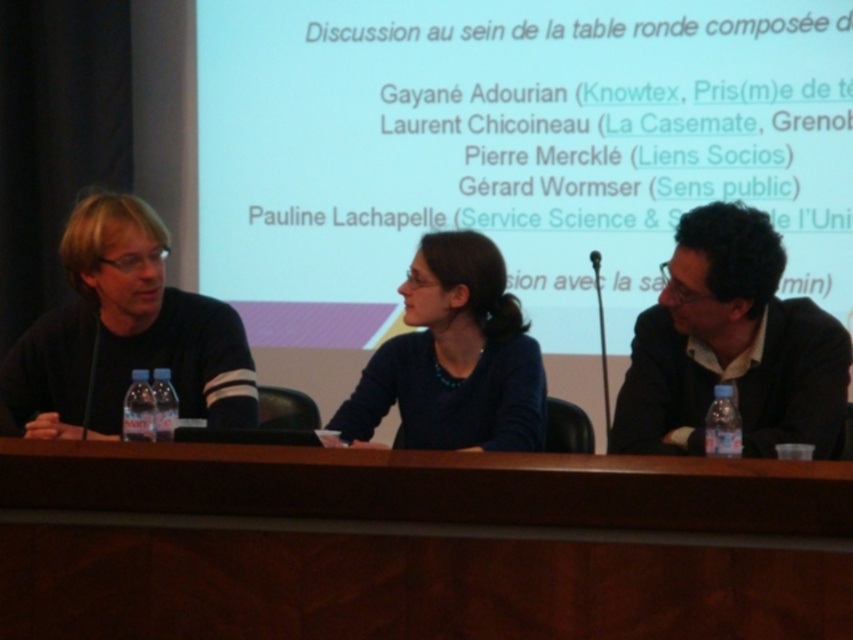
Which is below, brown wood table at center or dark brown leather jacket at right?

brown wood table at center is below.

Does brown wood table at center have a greater height compared to dark brown leather jacket at right?

Incorrect, brown wood table at center's height is not larger of dark brown leather jacket at right's.

Is point (103, 573) closer to camera compared to point (670, 330)?

That is True.

Image resolution: width=853 pixels, height=640 pixels. What are the coordinates of `brown wood table at center` in the screenshot? It's located at tap(416, 545).

Can you confirm if brown wood table at center is positioned to the right of black matte shirt at left?

Correct, you'll find brown wood table at center to the right of black matte shirt at left.

Measure the distance between brown wood table at center and black matte shirt at left.

brown wood table at center and black matte shirt at left are 37.55 inches apart from each other.

Where is `brown wood table at center`? The image size is (853, 640). brown wood table at center is located at coordinates (416, 545).

Between dark brown leather jacket at right and matte blue sweater at center, which one is positioned lower?

matte blue sweater at center

Measure the distance between point (689,410) and camera.

A distance of 2.59 meters exists between point (689,410) and camera.

Which is behind, point (720, 241) or point (492, 307)?

The point (492, 307) is behind.

Where is `dark brown leather jacket at right`? dark brown leather jacket at right is located at coordinates (730, 346).